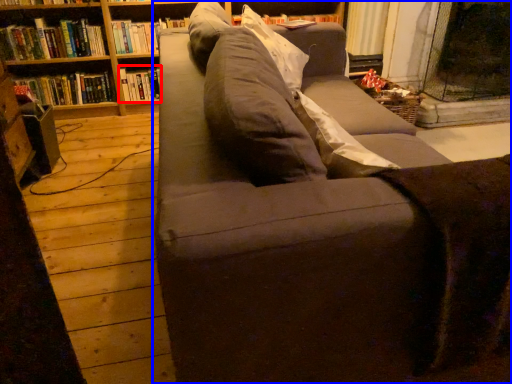
Question: Which object is further to the camera taking this photo, book (highlighted by a red box) or studio couch (highlighted by a blue box)?

Choices:
 (A) book
 (B) studio couch

Answer: (A)